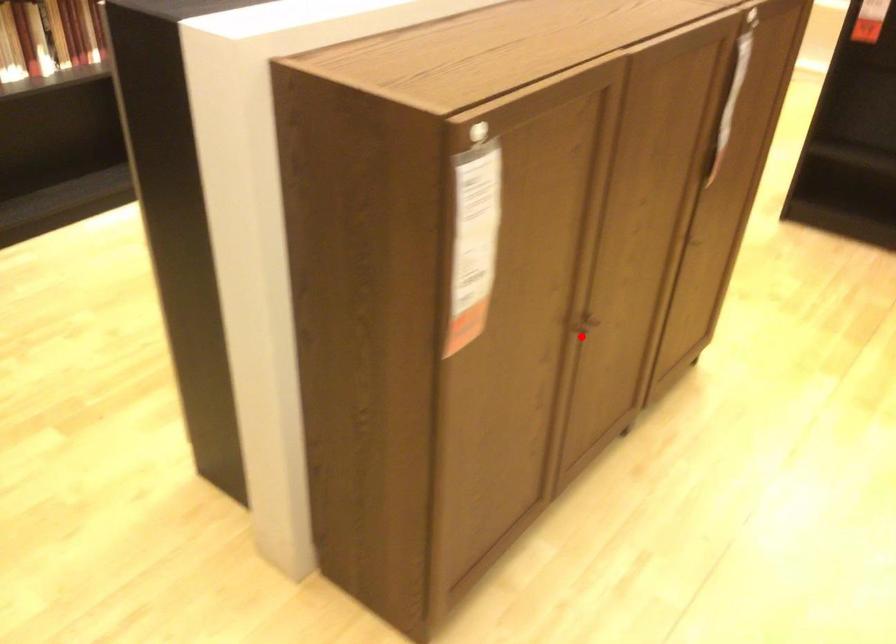
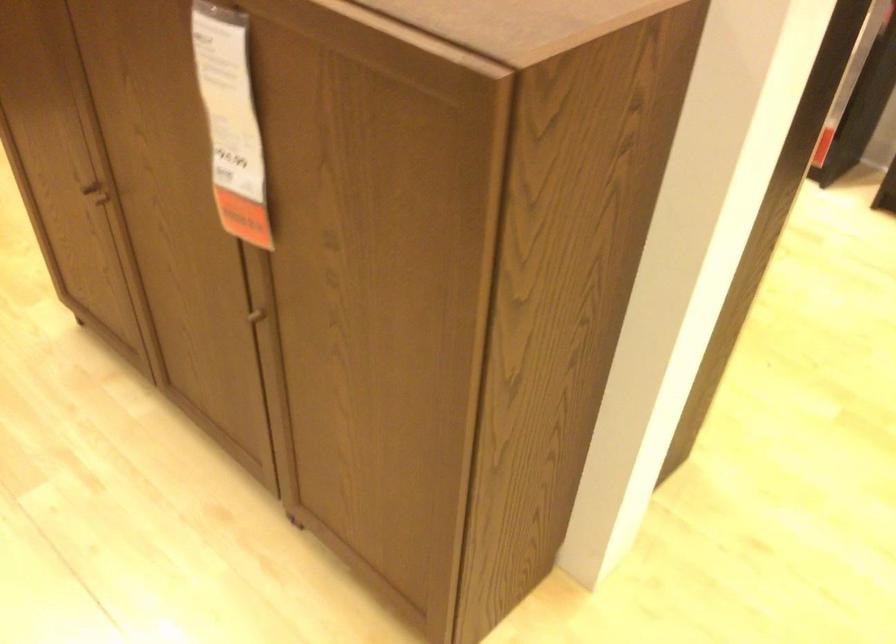
Question: I am providing you with two images of the same scene from different viewpoints. A red point is marked on the first image. Is the red point's position out of view in image 2?

Choices:
 (A) Yes
 (B) No

Answer: (B)